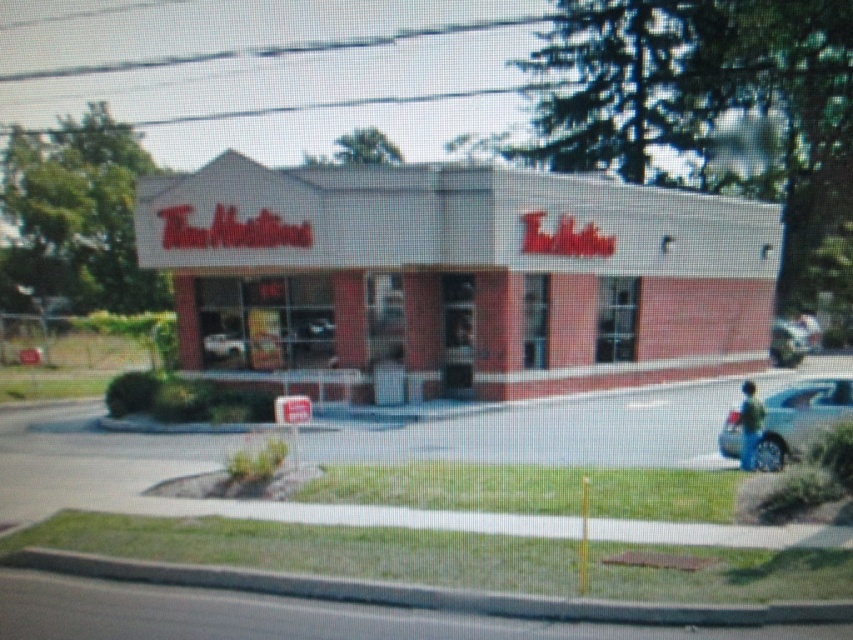
Question: Is white brick tim hortons at center smaller than metallic blue sedan at lower right?

Choices:
 (A) yes
 (B) no

Answer: (B)

Question: Among these objects, which one is nearest to the camera?

Choices:
 (A) metallic blue sedan at lower right
 (B) metallic silver car at right
 (C) white brick tim hortons at center
 (D) green fabric jacket at lower right

Answer: (A)

Question: Which object is positioned closest to the white brick tim hortons at center?

Choices:
 (A) metallic silver car at right
 (B) green fabric jacket at lower right
 (C) metallic blue sedan at lower right

Answer: (B)

Question: Is white brick tim hortons at center bigger than green fabric jacket at lower right?

Choices:
 (A) no
 (B) yes

Answer: (B)

Question: Which point is farther from the camera taking this photo?

Choices:
 (A) (747, 456)
 (B) (466, 262)

Answer: (B)

Question: Is white brick tim hortons at center below metallic blue sedan at lower right?

Choices:
 (A) yes
 (B) no

Answer: (B)